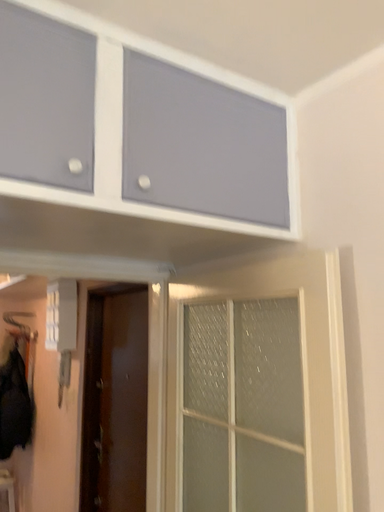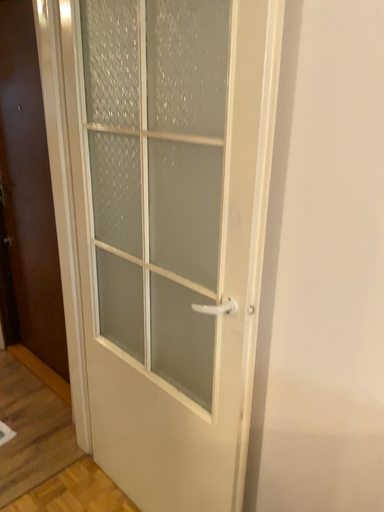
Question: Which way did the camera rotate in the video?

Choices:
 (A) rotated right
 (B) rotated left

Answer: (A)